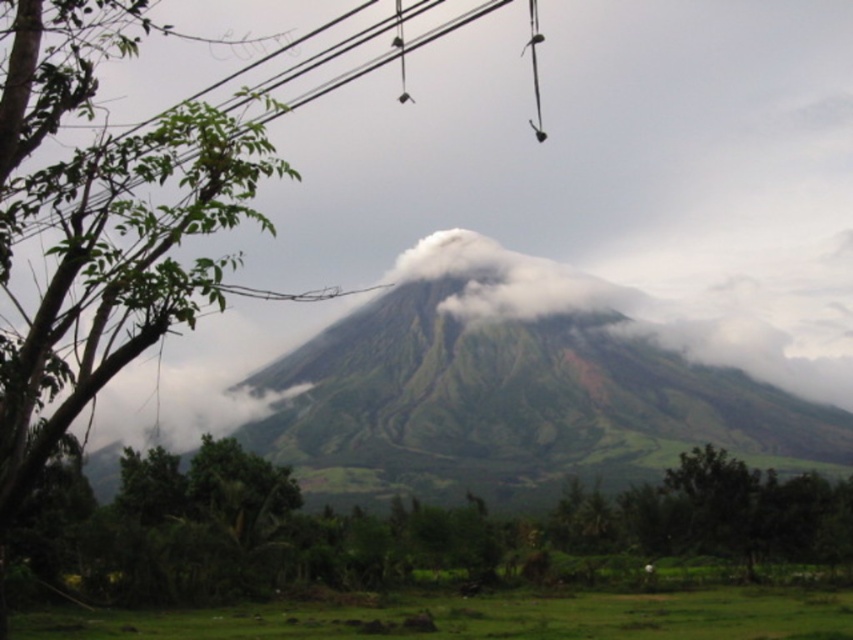
Question: Is green leafy tree at left wider than black wire at upper center?

Choices:
 (A) yes
 (B) no

Answer: (B)

Question: Does green leafy tree at left come in front of black wire at upper center?

Choices:
 (A) no
 (B) yes

Answer: (B)

Question: Where is green leafy tree at left located in relation to black wire at upper center in the image?

Choices:
 (A) below
 (B) above

Answer: (A)

Question: Which point is closer to the camera?

Choices:
 (A) (48, 218)
 (B) (424, 253)
 (C) (122, 13)

Answer: (A)

Question: Which object is positioned farthest from the green grassy mountain at center?

Choices:
 (A) green leafy tree at left
 (B) black wire at upper center

Answer: (A)

Question: Among these points, which one is nearest to the camera?

Choices:
 (A) (440, 35)
 (B) (851, 364)
 (C) (1, 483)

Answer: (C)